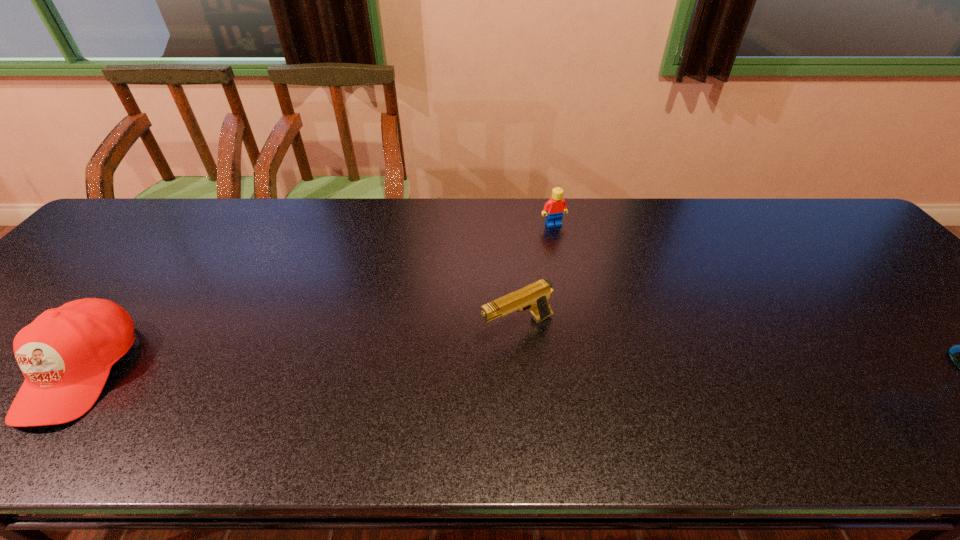
Locate an element on the screen. the rightmost object is located at coordinates (556, 206).

At what (x,y) coordinates should I click in order to perform the action: click on Lego. Please return your answer as a coordinate pair (x, y). Looking at the image, I should click on (556, 206).

Where is `pistol`? pistol is located at coordinates (535, 297).

This screenshot has height=540, width=960. In order to click on free space located on the face of the Lego in this screenshot , I will do click(x=564, y=242).

Where is `free space located 0.400m on the face of the Lego`? free space located 0.400m on the face of the Lego is located at coordinates (613, 328).

Find the location of a particular element. This screenshot has height=540, width=960. free region located on the face of the Lego is located at coordinates (571, 253).

You are a GUI agent. You are given a task and a screenshot of the screen. Output one action in this format:
    pyautogui.click(x=<x>, y=<y>)
    Task: Click on the vacant space situated 0.240m at the barrel of the pistol
    The image size is (960, 540).
    Given the screenshot: What is the action you would take?
    pyautogui.click(x=389, y=386)

Find the location of a particular element. Image resolution: width=960 pixels, height=540 pixels. blank space located 0.330m at the barrel of the pistol is located at coordinates (348, 406).

Locate an element on the screen. The image size is (960, 540). vacant area located at the barrel of the pistol is located at coordinates (348, 406).

Locate an element on the screen. object that is at the far edge is located at coordinates (556, 206).